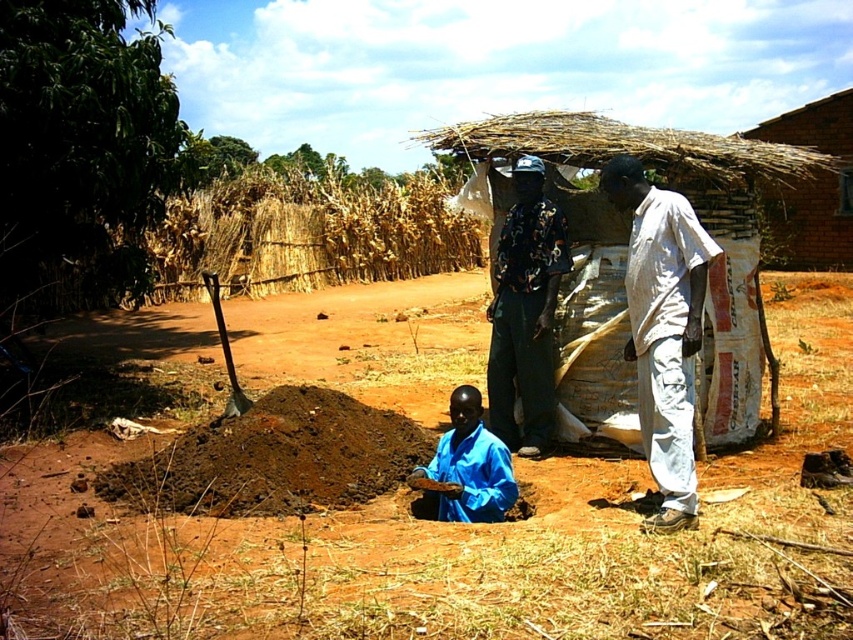
You are a surveyor measuring distances in the rural outdoor scene. You need to determine if the distance between the brown soil at center and the dry straw at upper center is sufficient for a 10 meter long fence. Can you confirm if the distance is enough?

The brown soil at center and dry straw at upper center are 8.94 meters apart. Since the required fence length is 10 meters, the distance between them is insufficient. You would need an additional 1.06 meters to accommodate the fence.

You are planning to build a small shelter using the materials available in the scene. You have the dry straw at upper center and the black printed shirt at center. Which material would you choose if you need a wider material for the roof?

The dry straw at upper center is wider than the black printed shirt at center, so you should choose the dry straw at upper center for the roof.